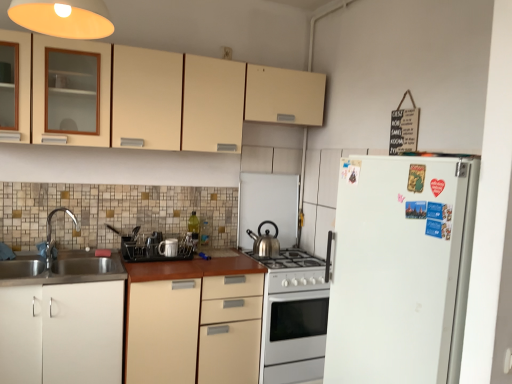
Question: Considering the relative sizes of white glossy gas stove at center and matte black dish rack at center, positioned as the 4th appliance in right-to-left order, in the image provided, is white glossy gas stove at center thinner than matte black dish rack at center, positioned as the 4th appliance in right-to-left order,?

Choices:
 (A) yes
 (B) no

Answer: (B)

Question: Is white glossy gas stove at center at the right side of matte black dish rack at center, positioned as the 4th appliance in right-to-left order?

Choices:
 (A) no
 (B) yes

Answer: (B)

Question: From the image's perspective, does white glossy gas stove at center appear higher than matte black dish rack at center, positioned as the 4th appliance in right-to-left order?

Choices:
 (A) yes
 (B) no

Answer: (B)

Question: Does white glossy gas stove at center have a larger size compared to matte black dish rack at center, positioned as the first appliance in left-to-right order?

Choices:
 (A) yes
 (B) no

Answer: (A)

Question: From a real-world perspective, is white glossy gas stove at center positioned over matte black dish rack at center, positioned as the 4th appliance in right-to-left order, based on gravity?

Choices:
 (A) yes
 (B) no

Answer: (B)

Question: Is white glossy gas stove at center closer to camera compared to matte black dish rack at center, positioned as the first appliance in left-to-right order?

Choices:
 (A) yes
 (B) no

Answer: (A)

Question: Is black plastic dish rack at center, which is the 3th appliance in right-to-left order, bigger than white ceramic mug at center, the third appliance positioned from the left?

Choices:
 (A) yes
 (B) no

Answer: (A)

Question: From the image's perspective, is black plastic dish rack at center, placed as the 2th appliance when sorted from left to right, over white ceramic mug at center, the third appliance positioned from the left?

Choices:
 (A) no
 (B) yes

Answer: (A)

Question: Is black plastic dish rack at center, placed as the 2th appliance when sorted from left to right, wider than white ceramic mug at center, the third appliance positioned from the left?

Choices:
 (A) yes
 (B) no

Answer: (A)

Question: Is the surface of black plastic dish rack at center, which is the 3th appliance in right-to-left order, in direct contact with white ceramic mug at center, which is counted as the 2th appliance, starting from the right?

Choices:
 (A) yes
 (B) no

Answer: (A)

Question: From the image's perspective, is black plastic dish rack at center, placed as the 2th appliance when sorted from left to right, below white ceramic mug at center, the third appliance positioned from the left?

Choices:
 (A) yes
 (B) no

Answer: (A)

Question: Is black plastic dish rack at center, placed as the 2th appliance when sorted from left to right, oriented towards white ceramic mug at center, the third appliance positioned from the left?

Choices:
 (A) yes
 (B) no

Answer: (A)

Question: From a real-world perspective, is matte black dish rack at center, positioned as the first appliance in left-to-right order, over matte cream cabinets at upper center, the 1th cabinetry in the top-to-bottom sequence?

Choices:
 (A) yes
 (B) no

Answer: (B)